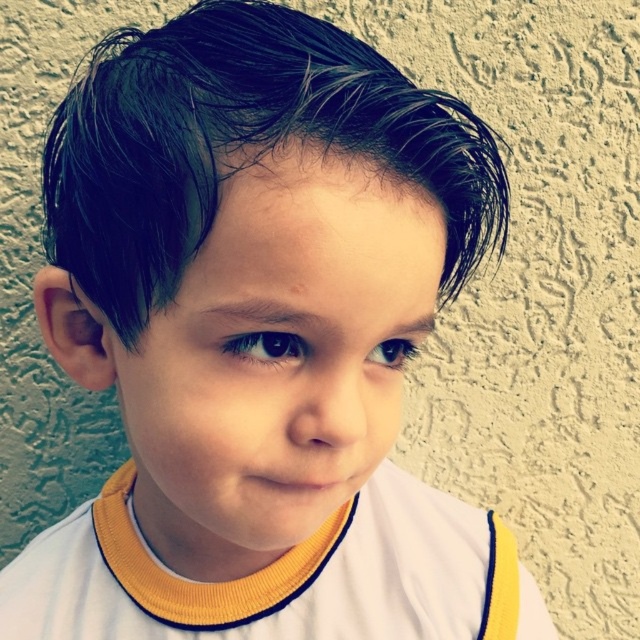
The height and width of the screenshot is (640, 640). What do you see at coordinates (241, 145) in the screenshot?
I see `wet black hair at center` at bounding box center [241, 145].

Does wet black hair at center have a lesser width compared to white jersey at center?

Indeed, wet black hair at center has a lesser width compared to white jersey at center.

Is point (100, 256) behind point (122, 560)?

That is False.

I want to click on wet black hair at center, so click(x=241, y=145).